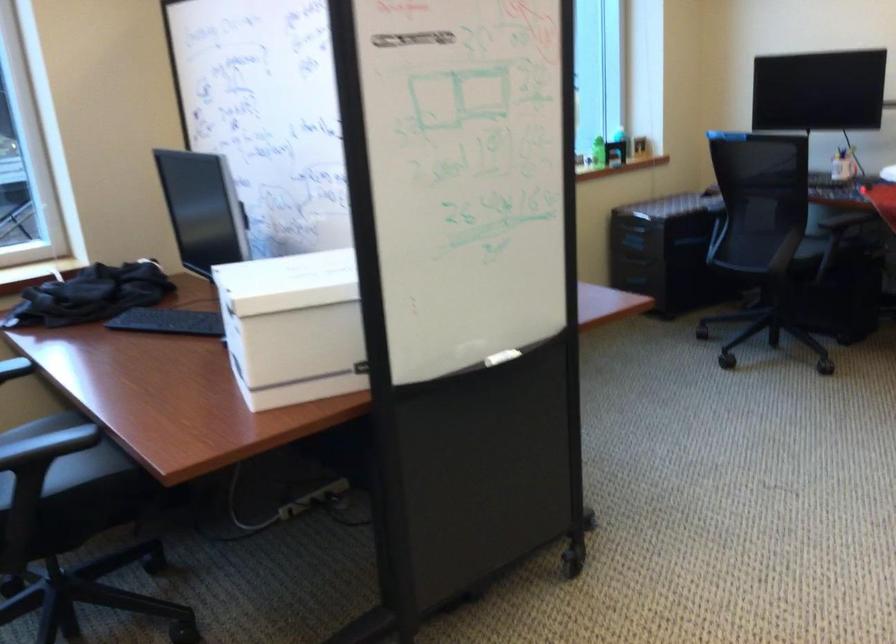
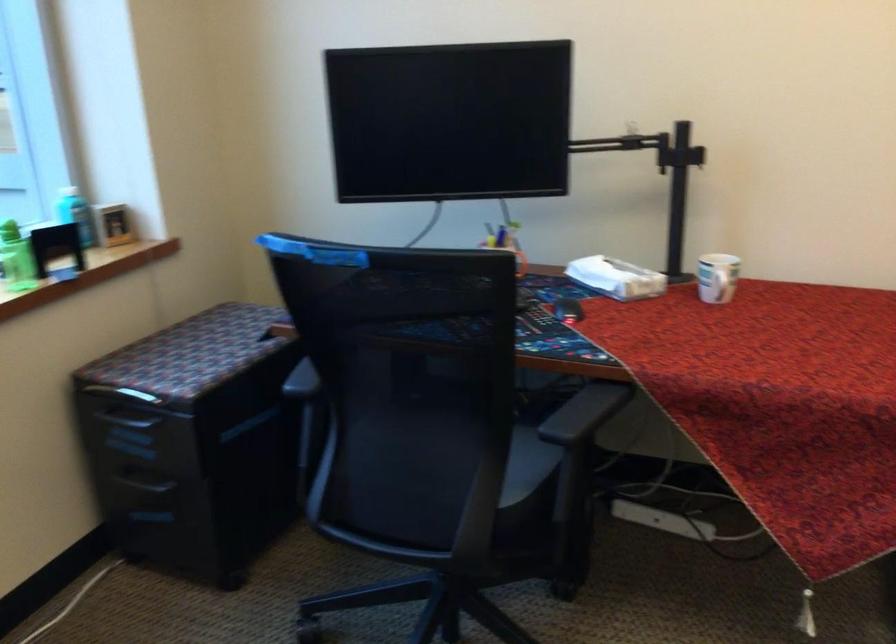
Find the pixel in the second image that matches pixel 623 122 in the first image.

(74, 214)